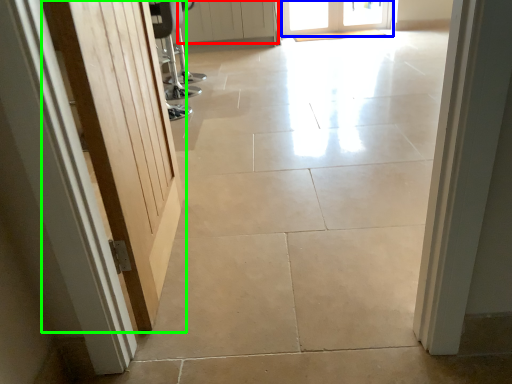
Question: Which object is positioned closest to door (highlighted by a red box)? Select from door (highlighted by a blue box) and door (highlighted by a green box).

Choices:
 (A) door
 (B) door

Answer: (A)